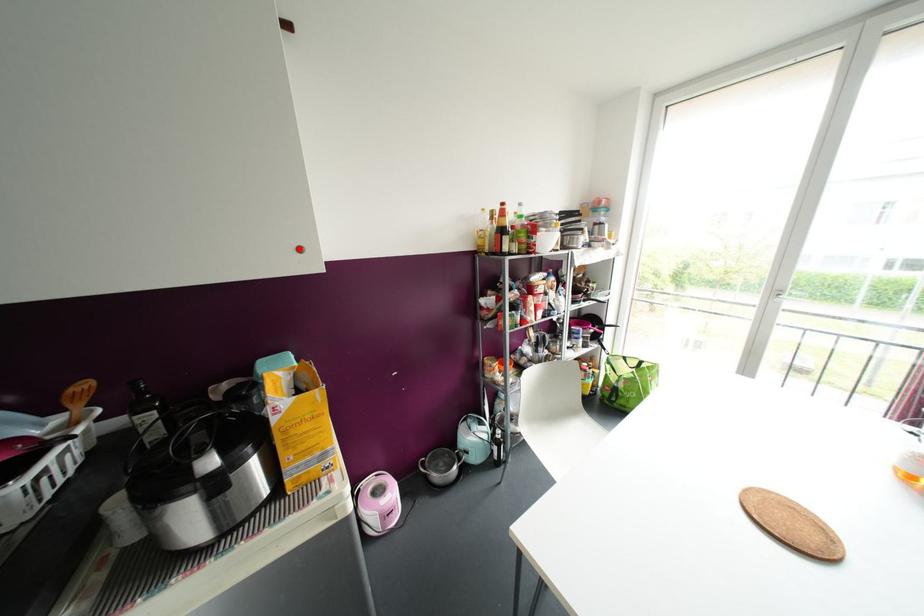
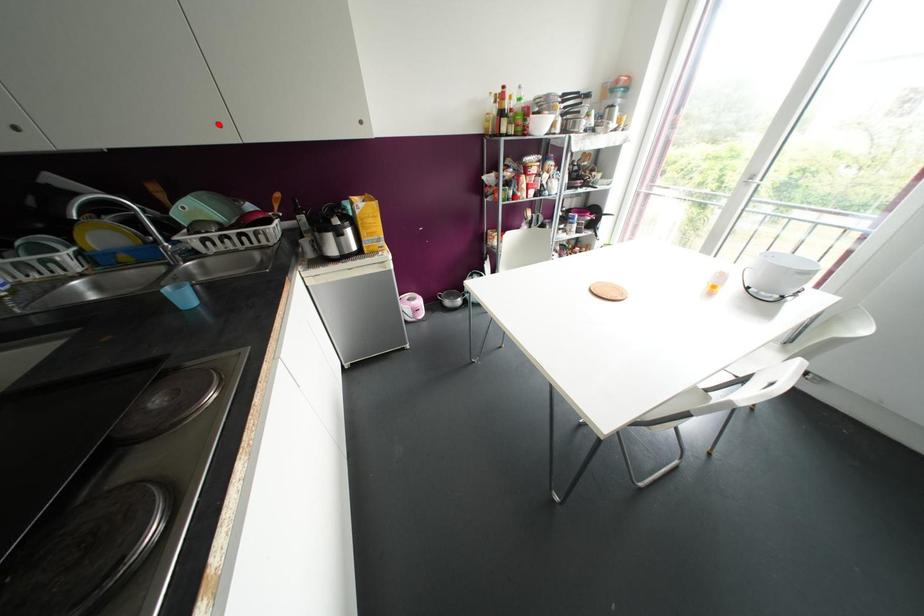
I am providing you with two images of the same scene from different viewpoints. A red point is marked on the first image and another point is marked on the second image. Are the points marked in image1 and image2 representing the same 3D position?

No